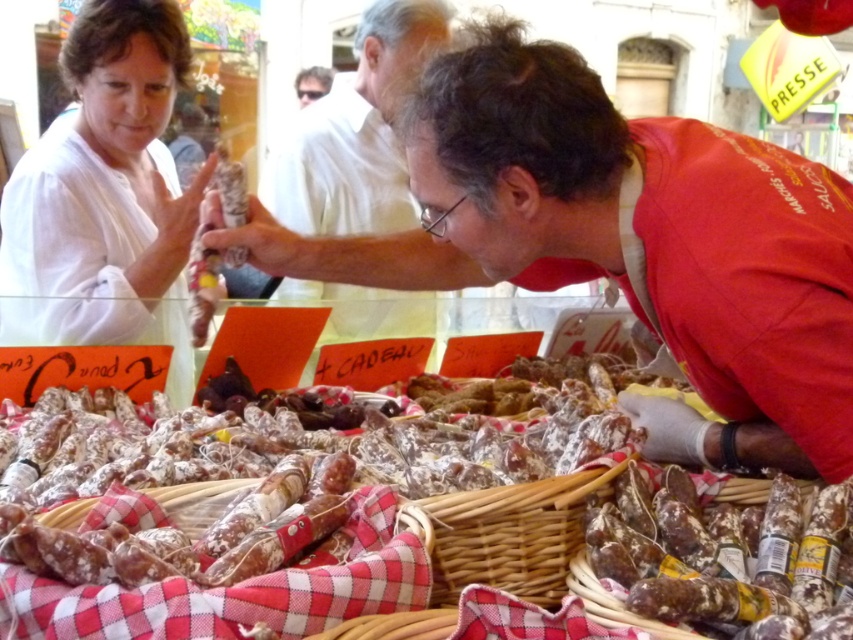
You are a customer at the market stall and want to point out the shiny silver sausage at center to the vendor. Which object should you mention is in front of the woven brown basket at center?

The shiny silver sausage at center is in front of the woven brown basket at center.

You are a customer at the market stall and want to know which item is bigger between the matte white shirt at upper left and the brown crinkled salami at center. Can you tell me?

The matte white shirt at upper left is larger in size than the brown crinkled salami at center.